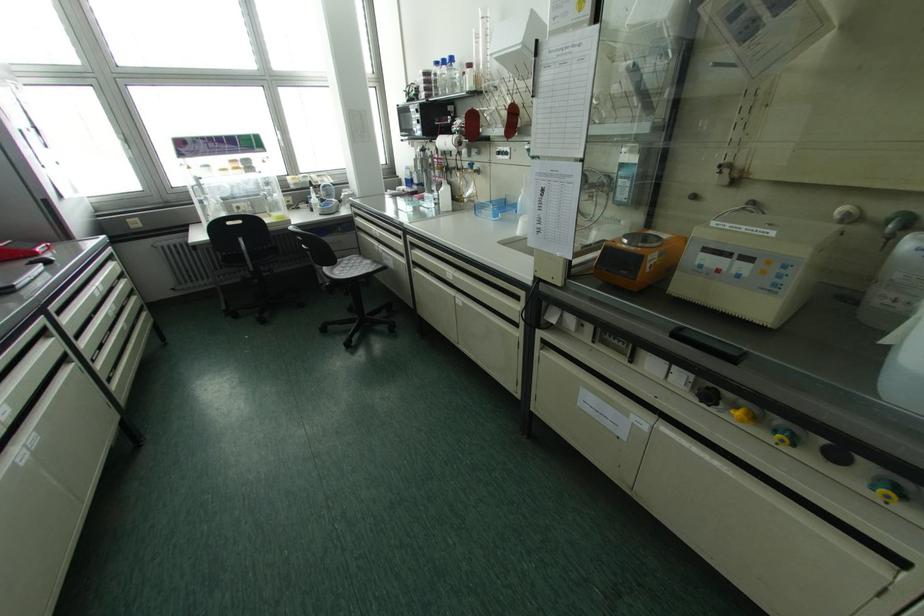
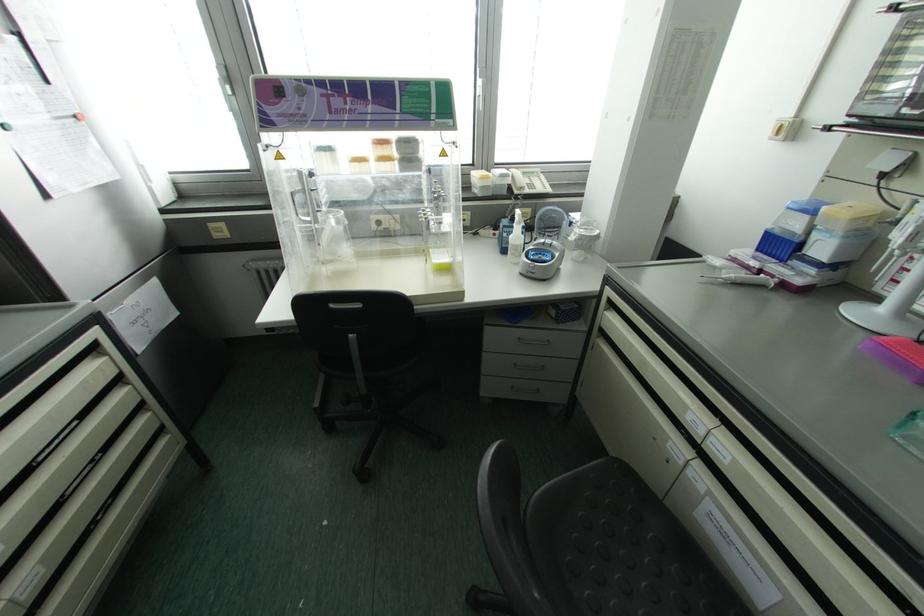
In the second image, find the point that corresponds to (313,199) in the first image.

(516, 235)